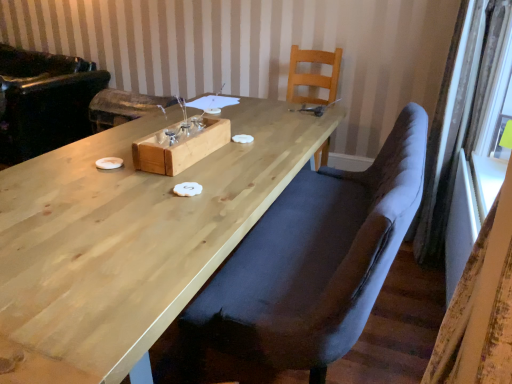
Question: Would you say yellowish fabric curtain at right, the 1th curtain ordered from the bottom, is to the left or to the right of black leather armchair at left in the picture?

Choices:
 (A) right
 (B) left

Answer: (A)

Question: From a real-world perspective, is yellowish fabric curtain at right, the 2th curtain in the top-to-bottom sequence, physically located above or below black leather armchair at left?

Choices:
 (A) below
 (B) above

Answer: (A)

Question: Based on their relative distances, which object is nearer to the velvet dark blue chair at center, the 1th chair positioned from the front?

Choices:
 (A) natural wood chair at upper center, which is the 2th chair in front-to-back order
 (B) natural wood tray at center
 (C) velvet curtain at right, positioned as the 1th curtain in top-to-bottom order
 (D) natural wood table at center
 (E) yellowish fabric curtain at right, the 2th curtain in the top-to-bottom sequence

Answer: (D)

Question: Which of these objects is positioned farthest from the velvet dark blue chair at center, the 1th chair positioned from the front?

Choices:
 (A) yellowish fabric curtain at right, the 1th curtain ordered from the bottom
 (B) natural wood chair at upper center, which is the 2th chair in front-to-back order
 (C) natural wood tray at center
 (D) velvet curtain at right, acting as the 2th curtain starting from the bottom
 (E) black leather armchair at left

Answer: (E)